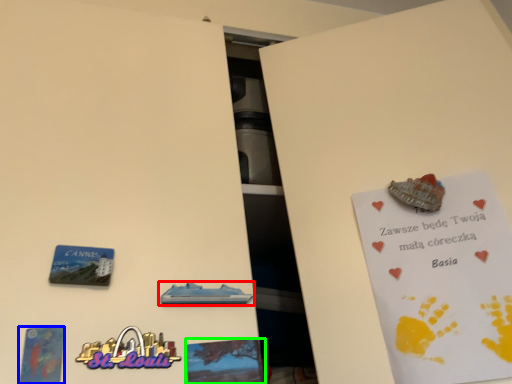
Question: Which is farther away from vehicle (highlighted by a red box)? postcard (highlighted by a blue box) or flyer (highlighted by a green box)?

Choices:
 (A) postcard
 (B) flyer

Answer: (A)